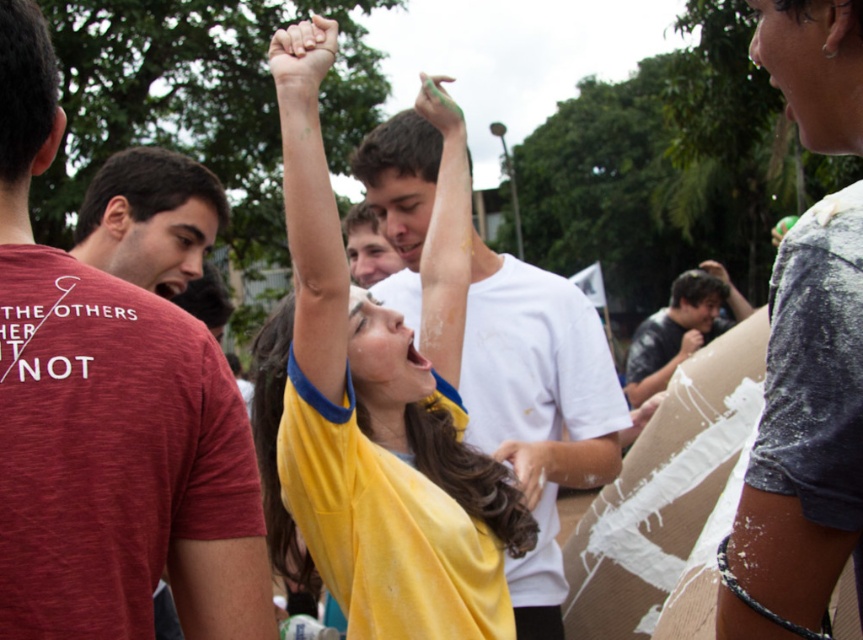
You are standing at the camera position and want to throw a small ball to the person wearing the yellow jersey at center. If your throwing range is up to 3 meters, will you be able to reach them?

The yellow jersey at center is 3.24 meters away from the camera, which is beyond your throwing range of 3 meters. You won not be able to reach them with a small ball.